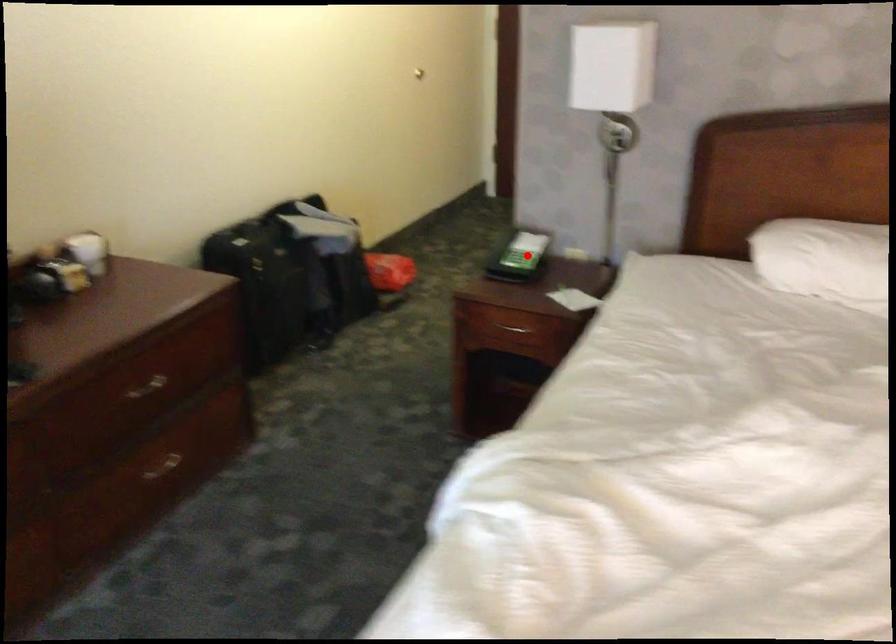
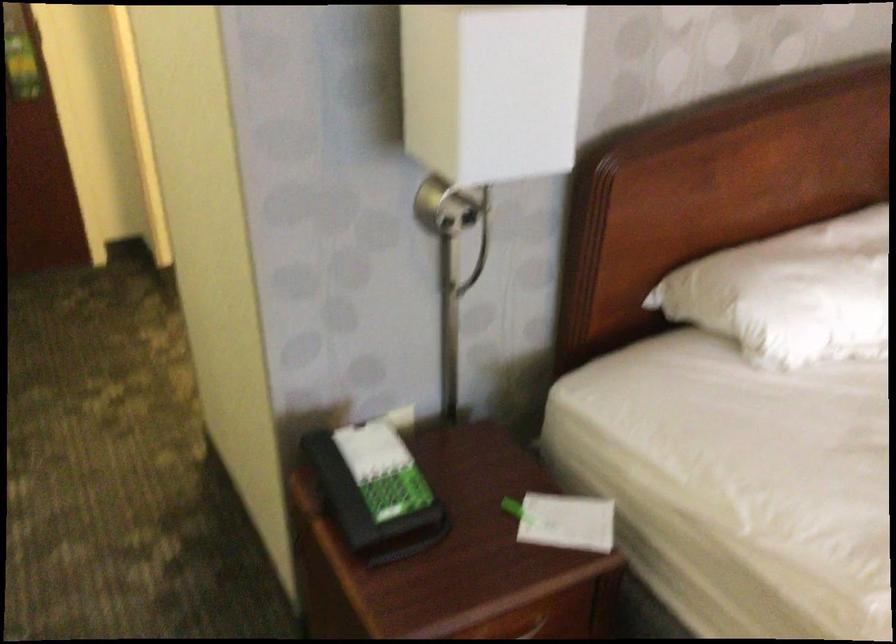
Question: I am providing you with two images of the same scene from different viewpoints. A red point is marked on the first image. Can you still see the location of the red point in image 2?

Choices:
 (A) Yes
 (B) No

Answer: (A)